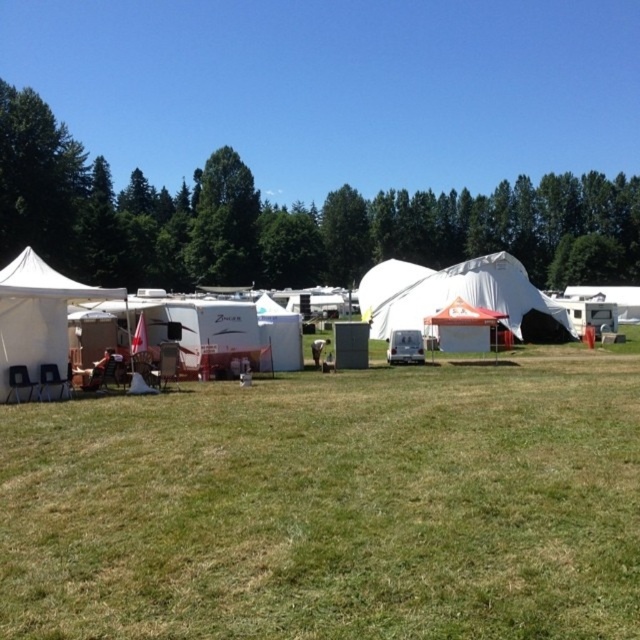
Question: Is green grassy field at center below white canvas tent at center?

Choices:
 (A) yes
 (B) no

Answer: (A)

Question: Does green grassy field at center appear on the left side of green leafy tree at upper left?

Choices:
 (A) yes
 (B) no

Answer: (A)

Question: Which point is closer to the camera?

Choices:
 (A) (509, 282)
 (B) (20, 275)

Answer: (B)

Question: Considering the relative positions of green grassy field at center and green leafy tree at upper left in the image provided, where is green grassy field at center located with respect to green leafy tree at upper left?

Choices:
 (A) left
 (B) right

Answer: (A)

Question: Which object is the closest to the white canvas tent at center?

Choices:
 (A) white canvas tent at left
 (B) white fabric tent at center

Answer: (B)

Question: Among these objects, which one is nearest to the camera?

Choices:
 (A) white canvas tent at center
 (B) green grassy field at center

Answer: (B)